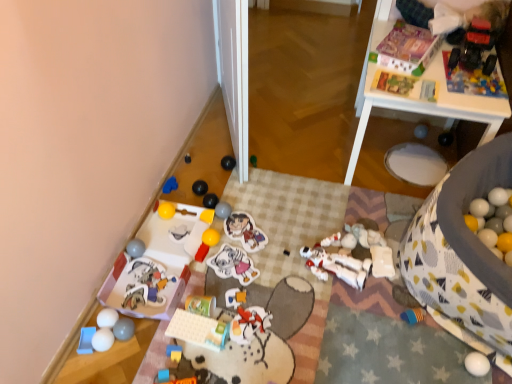
Find the location of a particular element. Image resolution: width=512 pixels, height=384 pixels. vacant space positioned to the left of rubber yellow block at lower center, the sixteenth toy when ordered from right to left is located at coordinates (148, 357).